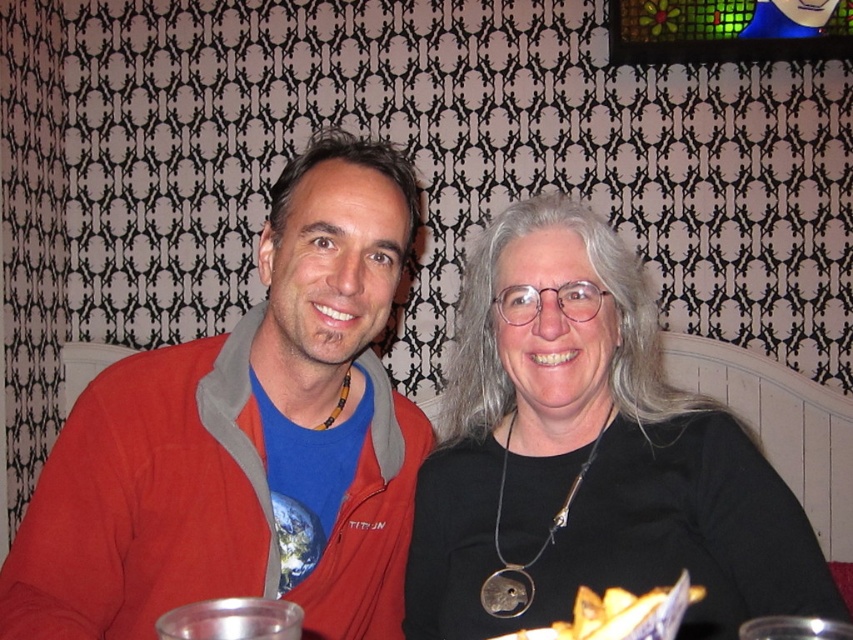
You are a delivery person who needs to place a small package that is 10 cm in width. You see the matte red jacket at left and the yellow crispy chips at lower center. Which object can the package fit next to without overlapping?

The yellow crispy chips at lower center are smaller than the matte red jacket at left, so the package can fit next to the yellow crispy chips at lower center since it requires less space.

You are at a cozy indoor gathering and want to grab the yellow crispy chips at lower center. However, the matte red jacket at left is blocking your view. Can you reach the chips without moving the jacket?

The yellow crispy chips at lower center is behind the matte red jacket at left, so you can reach them by moving around the jacket or from the side to access the chips without needing to move the jacket itself.